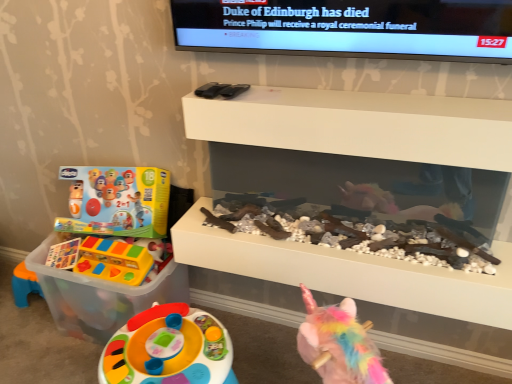
Question: Which direction should I rotate to look at white matte shelf at upper center, positioned as the 2th shelf in bottom-to-top order, — up or down?

Choices:
 (A) up
 (B) down

Answer: (A)

Question: Does translucent plastic toy at left, the first toy from the bottom, lie behind white matte shelf at upper center, positioned as the 2th shelf in bottom-to-top order?

Choices:
 (A) yes
 (B) no

Answer: (A)

Question: Can you confirm if translucent plastic toy at left, the first toy from the bottom, is thinner than white matte shelf at upper center, the first shelf from the top?

Choices:
 (A) yes
 (B) no

Answer: (B)

Question: Is translucent plastic toy at left, the second toy when ordered from top to bottom, with white matte shelf at upper center, positioned as the 2th shelf in bottom-to-top order?

Choices:
 (A) yes
 (B) no

Answer: (B)

Question: Is translucent plastic toy at left, the second toy when ordered from top to bottom, looking in the opposite direction of white matte shelf at upper center, positioned as the 2th shelf in bottom-to-top order?

Choices:
 (A) no
 (B) yes

Answer: (A)

Question: Is translucent plastic toy at left, the first toy from the bottom, smaller than white matte shelf at upper center, positioned as the 2th shelf in bottom-to-top order?

Choices:
 (A) no
 (B) yes

Answer: (A)

Question: Can you confirm if translucent plastic toy at left, the first toy from the bottom, is taller than white matte shelf at upper center, the first shelf from the top?

Choices:
 (A) no
 (B) yes

Answer: (B)

Question: Considering the relative sizes of white matte fireplace at center, the second shelf from the top, and translucent plastic toy at left, the first toy from the bottom, in the image provided, is white matte fireplace at center, the second shelf from the top, bigger than translucent plastic toy at left, the first toy from the bottom,?

Choices:
 (A) yes
 (B) no

Answer: (A)

Question: Can you confirm if white matte fireplace at center, marked as the first shelf in a bottom-to-top arrangement, is smaller than translucent plastic toy at left, the first toy from the bottom?

Choices:
 (A) no
 (B) yes

Answer: (A)

Question: Is the surface of white matte fireplace at center, marked as the first shelf in a bottom-to-top arrangement, in direct contact with translucent plastic toy at left, the first toy from the bottom?

Choices:
 (A) no
 (B) yes

Answer: (A)

Question: Is translucent plastic toy at left, the first toy from the bottom, at the back of white matte fireplace at center, marked as the first shelf in a bottom-to-top arrangement?

Choices:
 (A) no
 (B) yes

Answer: (A)

Question: Does white matte fireplace at center, the second shelf from the top, have a lesser width compared to translucent plastic toy at left, the first toy from the bottom?

Choices:
 (A) no
 (B) yes

Answer: (B)

Question: From a real-world perspective, is white matte fireplace at center, the second shelf from the top, located beneath translucent plastic toy at left, the second toy when ordered from top to bottom?

Choices:
 (A) no
 (B) yes

Answer: (A)

Question: Would you say white matte shelf at upper center, positioned as the 2th shelf in bottom-to-top order, is outside matte plastic toy at left, the first toy when ordered from top to bottom?

Choices:
 (A) no
 (B) yes

Answer: (B)